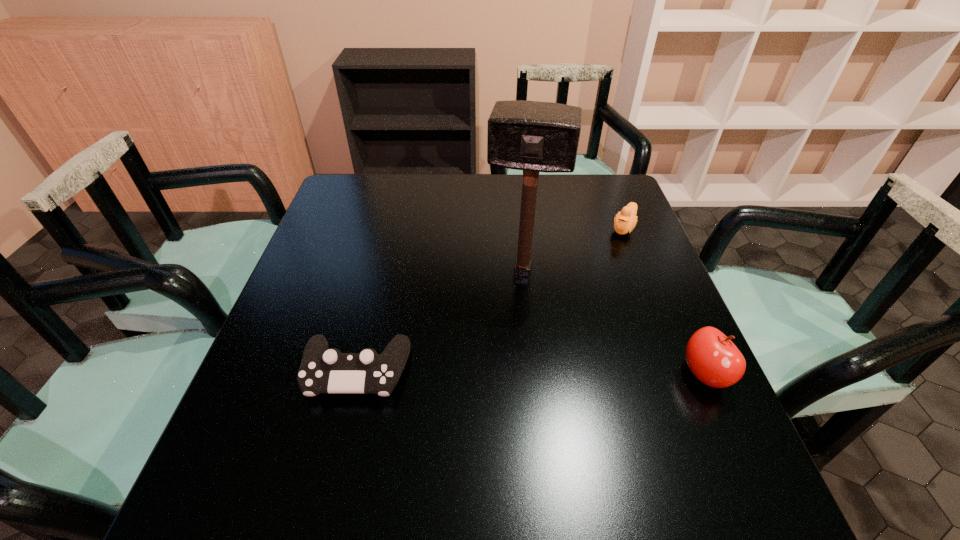
The width and height of the screenshot is (960, 540). Identify the location of vacant space on the desktop that is between the leftmost object and the third shortest object and is positioned on the head of the tallest object. (504, 373).

I want to click on vacant space on the desktop that is between the control and the third shortest object and is positioned on the face of the farthest object, so click(542, 373).